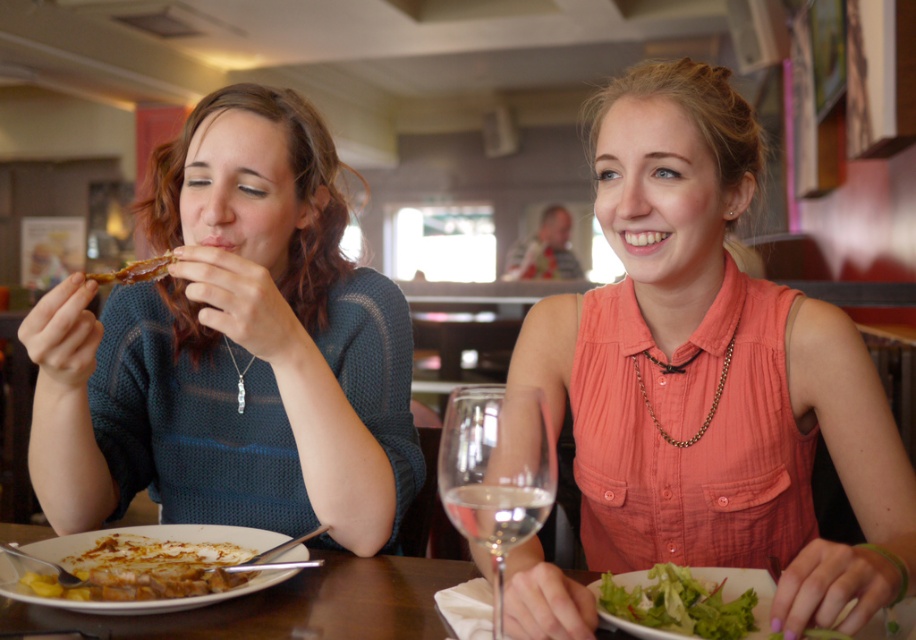
Question: Which point is farther to the camera?

Choices:
 (A) (694, 618)
 (B) (61, 368)
 (C) (714, 145)

Answer: (C)

Question: Which object appears farthest from the camera in this image?

Choices:
 (A) transparent glass at right
 (B) knitted blue sweater at left
 (C) orange fabric shirt at center
 (D) wooden table at center

Answer: (B)

Question: Can you confirm if knitted blue sweater at left is positioned above green leafy salad at lower right?

Choices:
 (A) no
 (B) yes

Answer: (B)

Question: Can you confirm if transparent glass at right is bigger than golden fried chicken at lower left?

Choices:
 (A) no
 (B) yes

Answer: (B)

Question: Which of the following is the closest to the observer?

Choices:
 (A) (544, 442)
 (B) (271, 225)
 (C) (23, 582)

Answer: (A)

Question: Is wooden table at center thinner than green leafy salad at lower right?

Choices:
 (A) yes
 (B) no

Answer: (B)